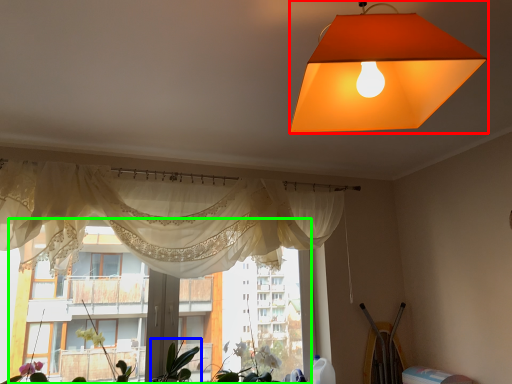
Question: Which is nearer to the lamp (highlighted by a red box)? plant (highlighted by a blue box) or bay window (highlighted by a green box).

Choices:
 (A) plant
 (B) bay window

Answer: (B)